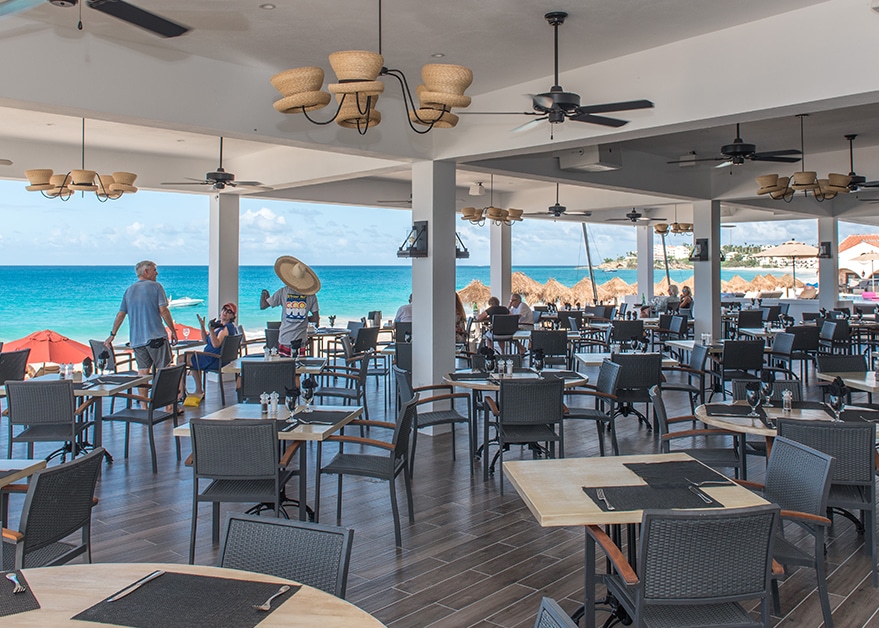
You are a GUI agent. You are given a task and a screenshot of the screen. Output one action in this format:
    pyautogui.click(x=<x>, y=<y>)
    Task: Click on the chair
    Image resolution: width=879 pixels, height=628 pixels.
    Given the screenshot: What is the action you would take?
    pyautogui.click(x=854, y=440)